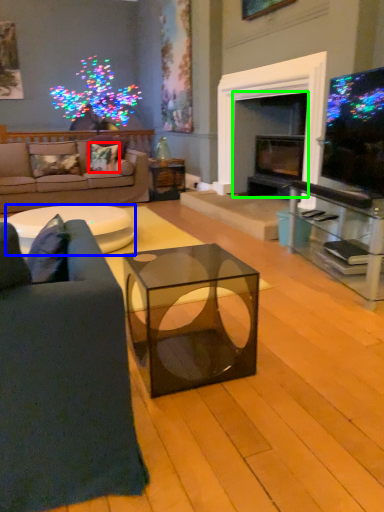
Question: Considering the real-world distances, which object is closest to pillow (highlighted by a red box)? table (highlighted by a blue box) or fireplace (highlighted by a green box).

Choices:
 (A) table
 (B) fireplace

Answer: (A)